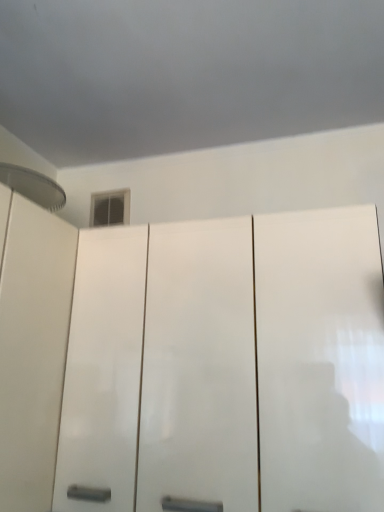
Find the location of `white glossy cupboard at center`. white glossy cupboard at center is located at coordinates (191, 362).

Describe the element at coordinates (191, 362) in the screenshot. The height and width of the screenshot is (512, 384). I see `white glossy cupboard at center` at that location.

Measure the distance between white glossy cupboard at center and camera.

They are 89.68 centimeters apart.

Locate an element on the screen. white glossy cupboard at center is located at coordinates (191, 362).